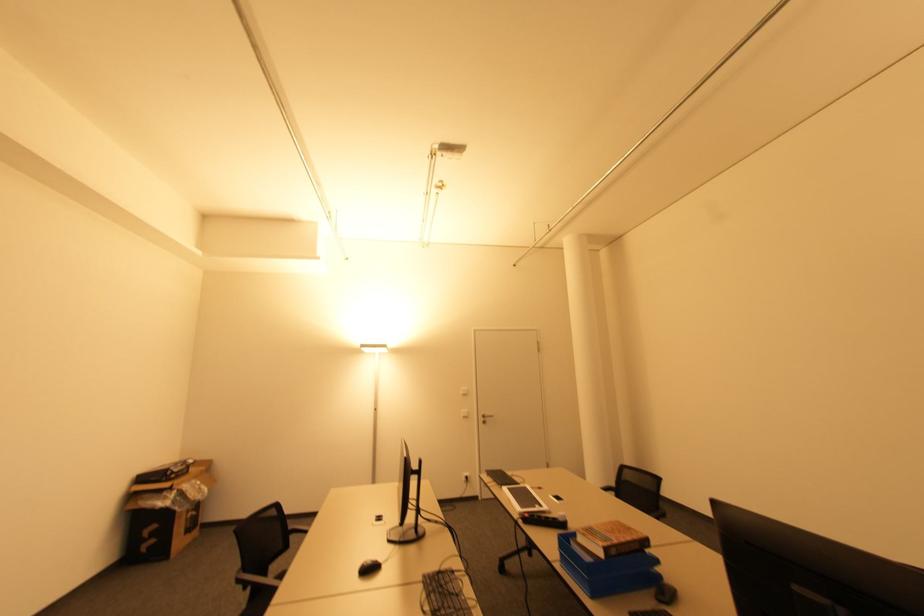
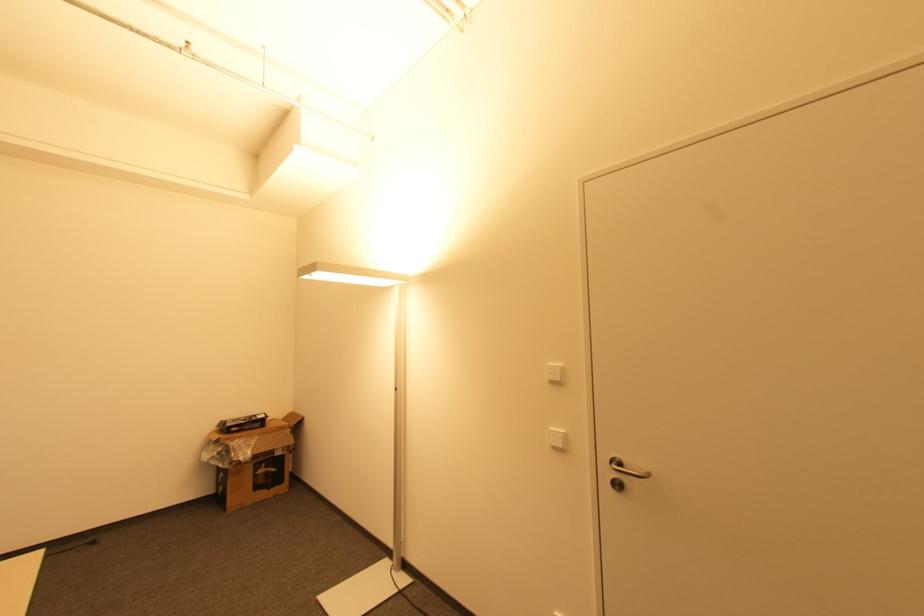
In the second image, find the point that corresponds to (x=484, y=418) in the first image.

(613, 469)